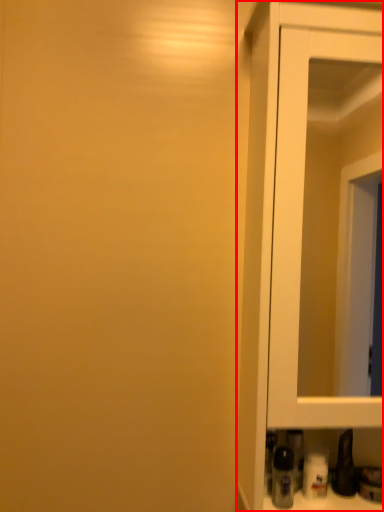
Question: Considering the relative positions of cupboard (annotated by the red box) and bottle in the image provided, where is cupboard (annotated by the red box) located with respect to the staircase?

Choices:
 (A) right
 (B) left

Answer: (A)